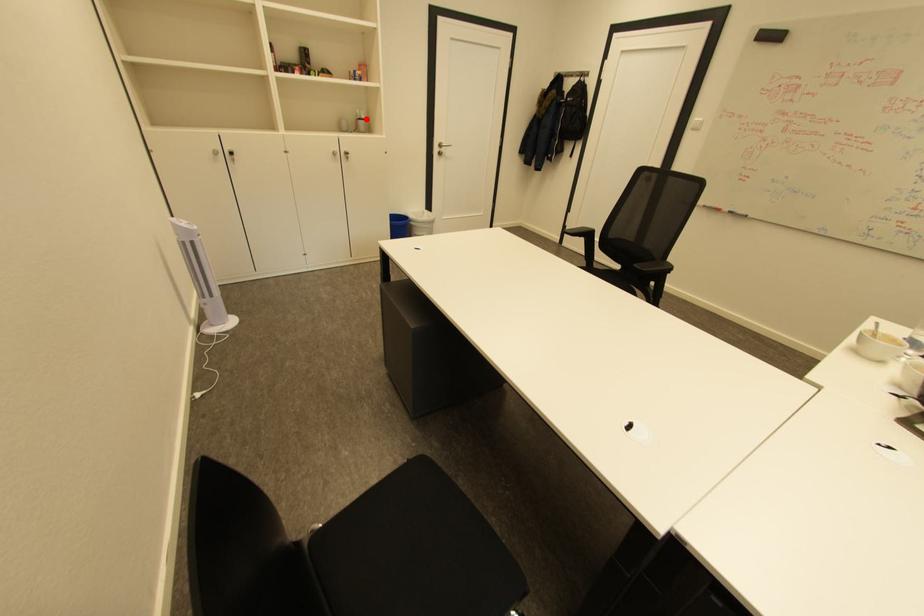
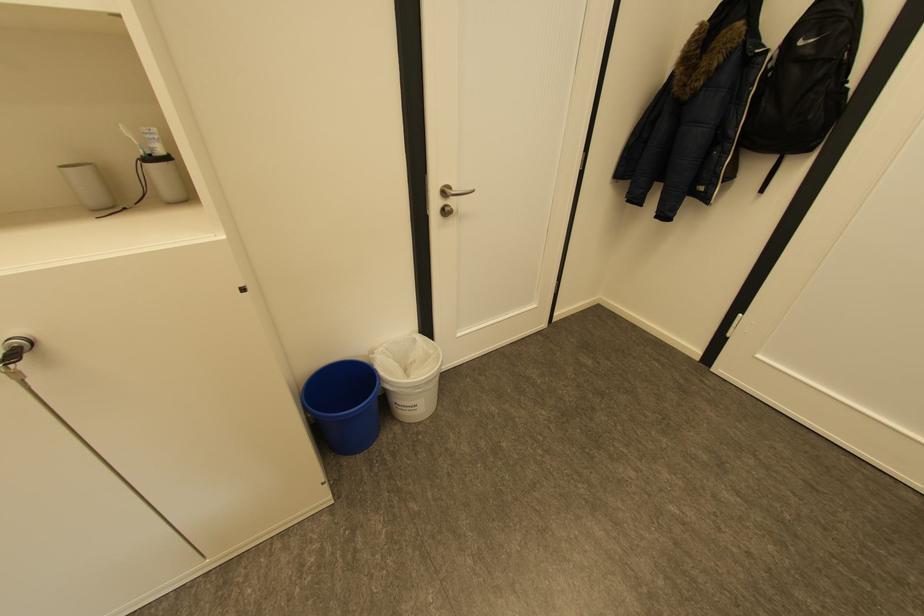
Find the pixel in the second image that matches the highlighted location in the first image.

(157, 159)